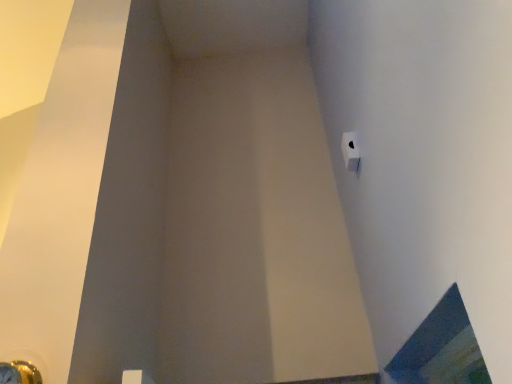
Identify the location of blue glass window at lower right. pyautogui.click(x=441, y=348).

The height and width of the screenshot is (384, 512). What do you see at coordinates (19, 373) in the screenshot?
I see `metallic gold door handle at lower left` at bounding box center [19, 373].

Where is `blue glass window at lower right`? The height and width of the screenshot is (384, 512). blue glass window at lower right is located at coordinates (441, 348).

Measure the distance from blue glass window at lower right to white matte toilet paper at upper right.

blue glass window at lower right is 67.08 centimeters away from white matte toilet paper at upper right.

Is blue glass window at lower right not inside white matte toilet paper at upper right?

Yes, blue glass window at lower right is not within white matte toilet paper at upper right.

Is blue glass window at lower right at the left side of white matte toilet paper at upper right?

In fact, blue glass window at lower right is to the right of white matte toilet paper at upper right.

From the image's perspective, which one is positioned higher, blue glass window at lower right or white matte toilet paper at upper right?

white matte toilet paper at upper right is shown above in the image.

From the image's perspective, is white matte toilet paper at upper right above or below blue glass window at lower right?

white matte toilet paper at upper right is situated higher than blue glass window at lower right in the image.

Where is `toilet paper located on the left of blue glass window at lower right`? This screenshot has height=384, width=512. toilet paper located on the left of blue glass window at lower right is located at coordinates (350, 151).

Which object is closer to the camera, white matte toilet paper at upper right or blue glass window at lower right?

blue glass window at lower right is in front.

Could you tell me if white matte toilet paper at upper right is turned towards blue glass window at lower right?

No, white matte toilet paper at upper right does not turn towards blue glass window at lower right.

Can you tell me how much metallic gold door handle at lower left and white matte toilet paper at upper right differ in facing direction?

metallic gold door handle at lower left and white matte toilet paper at upper right are facing 87.9 degrees away from each other.

Identify the location of toilet paper above the metallic gold door handle at lower left (from a real-world perspective). Image resolution: width=512 pixels, height=384 pixels. (350, 151).

Is metallic gold door handle at lower left spatially inside white matte toilet paper at upper right, or outside of it?

The correct answer is: outside.

Between metallic gold door handle at lower left and white matte toilet paper at upper right, which one is positioned behind?

white matte toilet paper at upper right is further away from the camera.

Between white matte toilet paper at upper right and metallic gold door handle at lower left, which one appears on the right side from the viewer's perspective?

white matte toilet paper at upper right.

Between white matte toilet paper at upper right and metallic gold door handle at lower left, which one has smaller width?

Thinner between the two is white matte toilet paper at upper right.

Can you tell me how much white matte toilet paper at upper right and metallic gold door handle at lower left differ in facing direction?

The angular difference between white matte toilet paper at upper right and metallic gold door handle at lower left is 87.9 degrees.

Are blue glass window at lower right and metallic gold door handle at lower left making contact?

There is a gap between blue glass window at lower right and metallic gold door handle at lower left.

Is metallic gold door handle at lower left inside blue glass window at lower right?

Definitely not — metallic gold door handle at lower left is not inside blue glass window at lower right.

Which of these two, blue glass window at lower right or metallic gold door handle at lower left, stands shorter?

Standing shorter between the two is blue glass window at lower right.

In the image, is blue glass window at lower right positioned in front of or behind metallic gold door handle at lower left?

Clearly, blue glass window at lower right is in front of metallic gold door handle at lower left.

Is the depth of metallic gold door handle at lower left less than that of blue glass window at lower right?

No, the depth of metallic gold door handle at lower left is greater than that of blue glass window at lower right.

Consider the image. Are metallic gold door handle at lower left and blue glass window at lower right beside each other?

No, metallic gold door handle at lower left is not in contact with blue glass window at lower right.

Is metallic gold door handle at lower left bigger or smaller than blue glass window at lower right?

Considering their sizes, metallic gold door handle at lower left takes up less space than blue glass window at lower right.

From the image's perspective, would you say metallic gold door handle at lower left is shown under blue glass window at lower right?

Yes, from the image's perspective, metallic gold door handle at lower left is beneath blue glass window at lower right.

What are the coordinates of `toilet paper behind the blue glass window at lower right` in the screenshot? It's located at (350, 151).

You are a GUI agent. You are given a task and a screenshot of the screen. Output one action in this format:
    pyautogui.click(x=<x>, y=<y>)
    Task: Click on the window below the white matte toilet paper at upper right (from the image's perspective)
    The height and width of the screenshot is (384, 512).
    Given the screenshot: What is the action you would take?
    pyautogui.click(x=441, y=348)

Based on their spatial positions, is blue glass window at lower right or white matte toilet paper at upper right further from metallic gold door handle at lower left?

Based on the image, white matte toilet paper at upper right appears to be further to metallic gold door handle at lower left.

In the scene shown: Estimate the real-world distances between objects in this image. Which object is further from metallic gold door handle at lower left, white matte toilet paper at upper right or blue glass window at lower right?

The object further to metallic gold door handle at lower left is white matte toilet paper at upper right.

From the image, which object appears to be nearer to blue glass window at lower right, white matte toilet paper at upper right or metallic gold door handle at lower left?

The object closer to blue glass window at lower right is white matte toilet paper at upper right.

Based on their spatial positions, is blue glass window at lower right or metallic gold door handle at lower left closer to white matte toilet paper at upper right?

blue glass window at lower right is closer to white matte toilet paper at upper right.

Estimate the real-world distances between objects in this image. Which object is further from blue glass window at lower right, metallic gold door handle at lower left or white matte toilet paper at upper right?

metallic gold door handle at lower left is further to blue glass window at lower right.

Which object lies nearer to the anchor point white matte toilet paper at upper right, metallic gold door handle at lower left or blue glass window at lower right?

blue glass window at lower right is closer to white matte toilet paper at upper right.

Find the location of `toilet paper between metallic gold door handle at lower left and blue glass window at lower right`. toilet paper between metallic gold door handle at lower left and blue glass window at lower right is located at coordinates (350, 151).